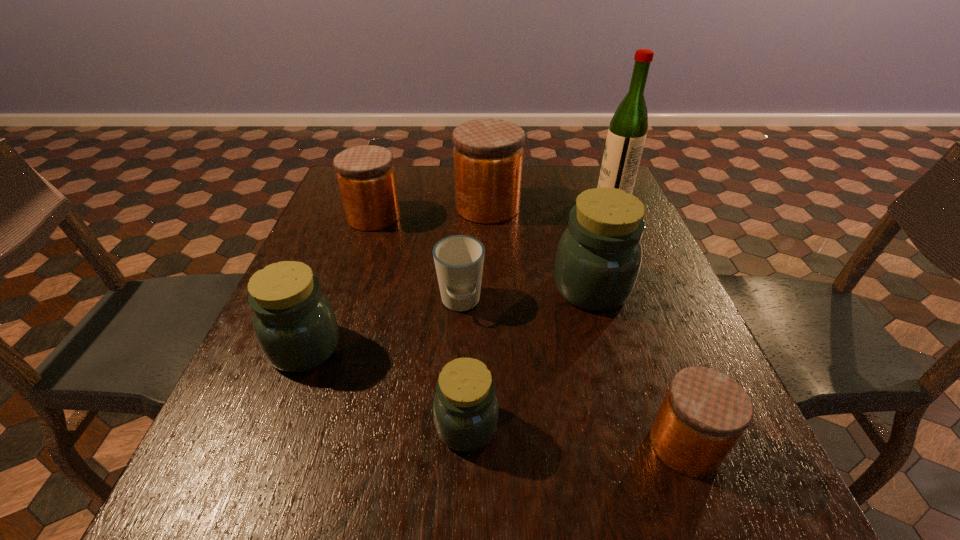
You are a GUI agent. You are given a task and a screenshot of the screen. Output one action in this format:
    pyautogui.click(x=<x>, y=<y>)
    Task: Click on the vacant space located 0.400m with a handle on the side of the cup
    The width and height of the screenshot is (960, 540).
    Given the screenshot: What is the action you would take?
    pyautogui.click(x=450, y=528)

Locate an element on the screen. Image resolution: width=960 pixels, height=540 pixels. vacant space located 0.130m on the right of the smallest green jar is located at coordinates (575, 426).

At what (x,y) coordinates should I click in order to perform the action: click on free space located 0.240m on the back of the nearest orange jar. Please return your answer as a coordinate pair (x, y). Image resolution: width=960 pixels, height=540 pixels. Looking at the image, I should click on click(636, 315).

Locate an element on the screen. The height and width of the screenshot is (540, 960). liquor that is at the far edge is located at coordinates (626, 136).

You are a GUI agent. You are given a task and a screenshot of the screen. Output one action in this format:
    pyautogui.click(x=<x>, y=<y>)
    Task: Click on the object located at the near edge
    This screenshot has width=960, height=540.
    Given the screenshot: What is the action you would take?
    pyautogui.click(x=704, y=413)

Locate an element on the screen. The height and width of the screenshot is (540, 960). liquor that is at the right edge is located at coordinates (626, 136).

Where is `object present at the far left corner`? This screenshot has height=540, width=960. object present at the far left corner is located at coordinates (366, 177).

Locate an element on the screen. The width and height of the screenshot is (960, 540). object present at the far right corner is located at coordinates (626, 136).

The height and width of the screenshot is (540, 960). I want to click on object that is positioned at the near right corner, so click(704, 413).

Image resolution: width=960 pixels, height=540 pixels. I want to click on vacant space at the far edge, so click(x=416, y=180).